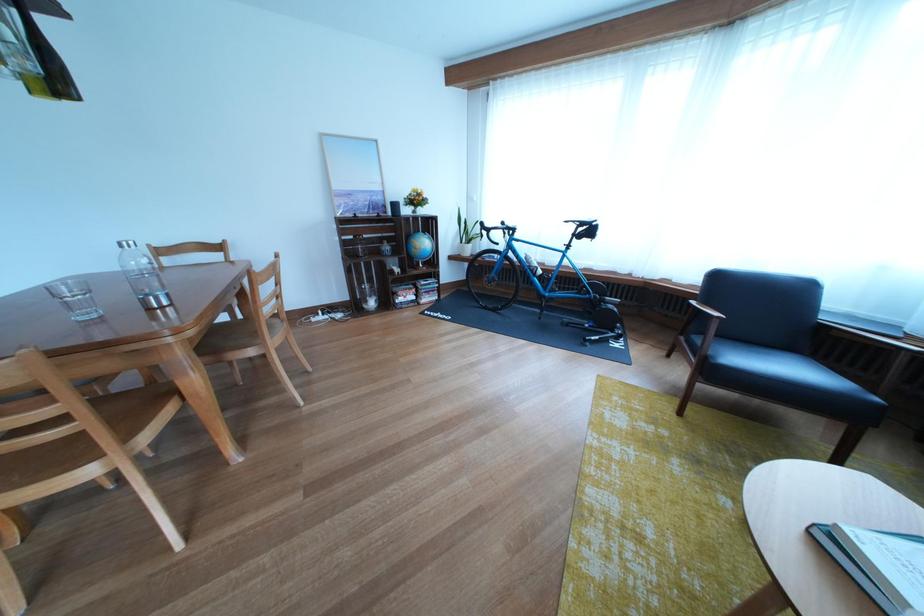
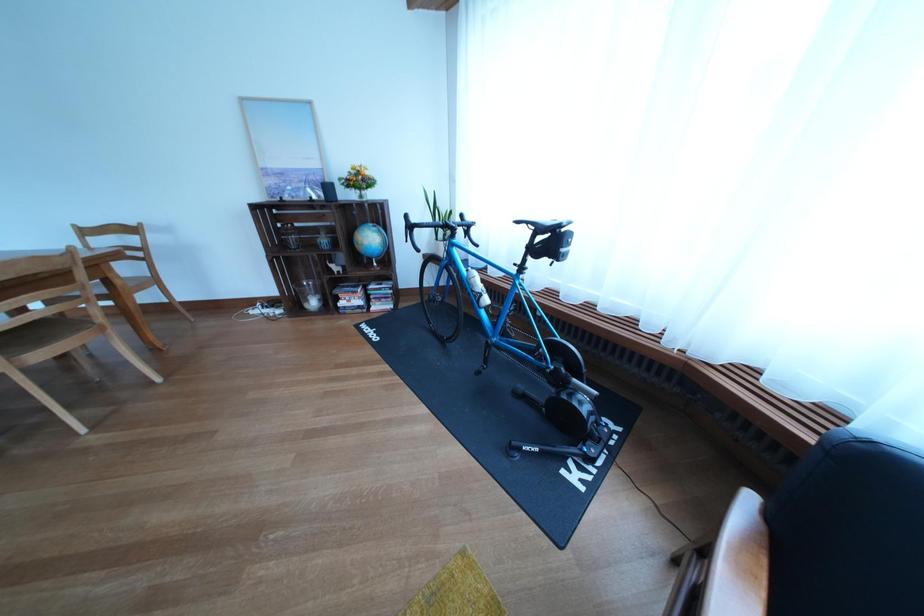
The point at (419, 302) is marked in the first image. Where is the corresponding point in the second image?

(363, 306)